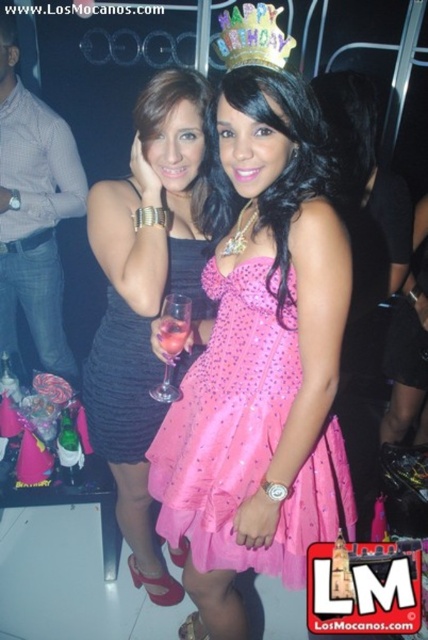
Question: Does matte black dress at center appear under gold glittery crown at upper center?

Choices:
 (A) no
 (B) yes

Answer: (B)

Question: Among these points, which one is farthest from the camera?

Choices:
 (A) (300, 531)
 (B) (190, 144)

Answer: (B)

Question: Can you confirm if black satin dress at center is positioned to the right of gold glittery crown at upper center?

Choices:
 (A) no
 (B) yes

Answer: (A)

Question: Is matte black dress at center to the right of clear glass at center from the viewer's perspective?

Choices:
 (A) no
 (B) yes

Answer: (A)

Question: Estimate the real-world distances between objects in this image. Which object is closer to the gold glittery crown at upper center?

Choices:
 (A) clear glass at center
 (B) black satin dress at center

Answer: (A)

Question: Among these objects, which one is nearest to the camera?

Choices:
 (A) black satin dress at center
 (B) clear glass at center
 (C) pink satin dress at center

Answer: (C)